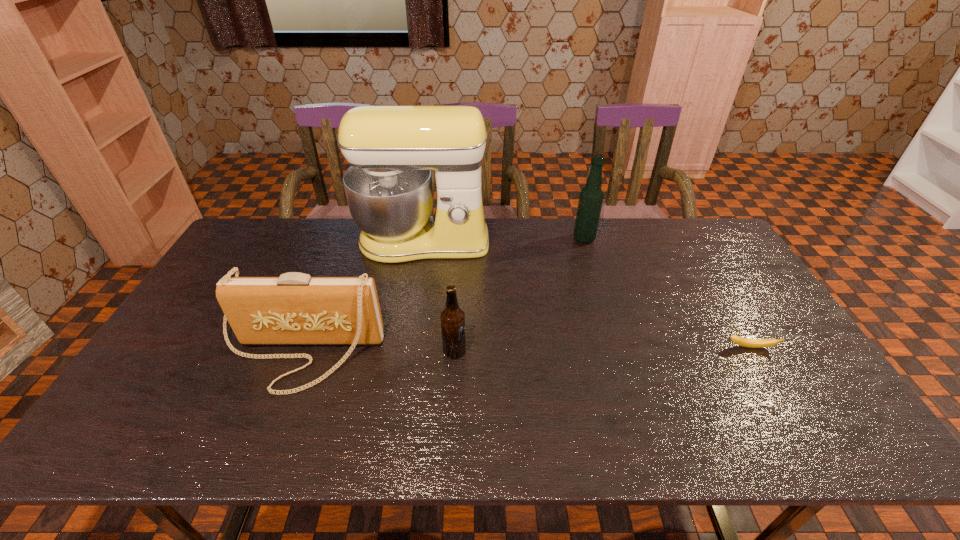
Locate an element on the screen. vacant space positioned 0.120m on the label of the beer bottle is located at coordinates point(511,351).

This screenshot has width=960, height=540. In order to click on free space located 0.240m at the stem of the rightmost object in this screenshot , I will do `click(803, 435)`.

At what (x,y) coordinates should I click in order to perform the action: click on mixer present at the far edge. Please return your answer as a coordinate pair (x, y). The image size is (960, 540). Looking at the image, I should click on (391, 149).

The height and width of the screenshot is (540, 960). In order to click on alcohol that is at the far edge in this screenshot , I will do `click(591, 197)`.

Find the location of a particular element. Image resolution: width=960 pixels, height=540 pixels. object that is at the left edge is located at coordinates (x=295, y=308).

This screenshot has width=960, height=540. I want to click on object that is at the right edge, so click(745, 342).

The image size is (960, 540). I want to click on free region at the far edge, so click(x=652, y=252).

The image size is (960, 540). I want to click on blank space at the near edge of the desktop, so click(358, 427).

At what (x,y) coordinates should I click in order to perform the action: click on free space at the right edge of the desktop. Please return your answer as a coordinate pair (x, y). The image size is (960, 540). Looking at the image, I should click on (794, 364).

At what (x,y) coordinates should I click in order to perform the action: click on free space at the near left corner of the desktop. Please return your answer as a coordinate pair (x, y). The height and width of the screenshot is (540, 960). Looking at the image, I should click on (168, 416).